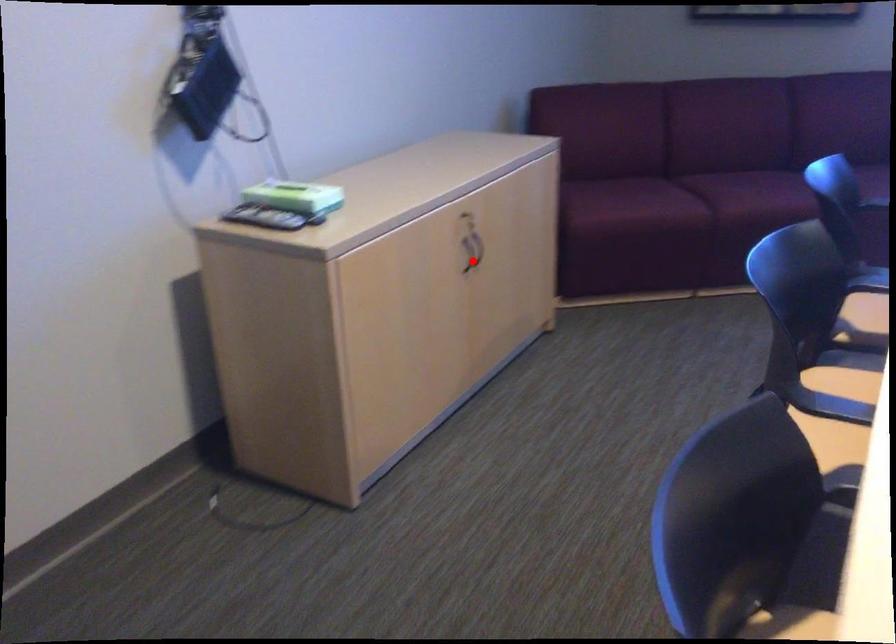
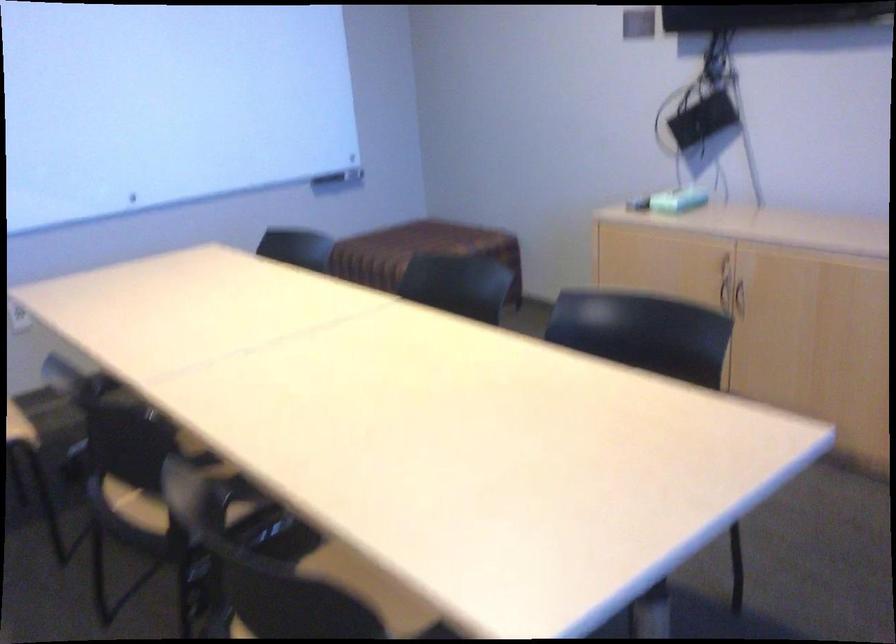
Locate, in the second image, the point that corresponds to the highlighted location in the first image.

(738, 299)